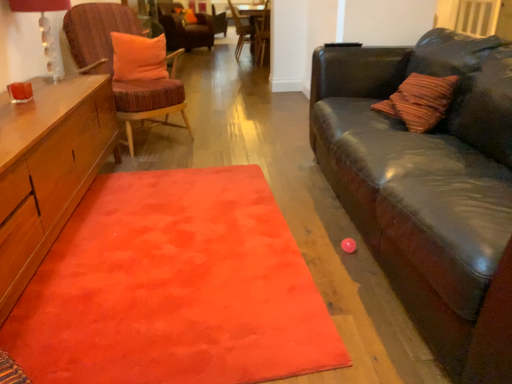
Question: Considering the positions of velvet orange cushion at upper center, the 1th chair when ordered from back to front, and wooden side table at center in the image, is velvet orange cushion at upper center, the 1th chair when ordered from back to front, taller or shorter than wooden side table at center?

Choices:
 (A) tall
 (B) short

Answer: (A)

Question: From the image's perspective, is velvet orange cushion at upper center, the 1th chair when ordered from back to front, above or below wooden side table at center?

Choices:
 (A) above
 (B) below

Answer: (A)

Question: Which of these objects is positioned farthest from the velvet orange cushion at upper center, which is the 4th chair in front-to-back order?

Choices:
 (A) wooden side table at center
 (B) wooden textured chair at upper center, positioned as the third chair in front-to-back order
 (C) orange fabric pillow at upper center, placed as the first pillow when sorted from left to right
 (D) orange plush pillow at upper left, which is counted as the first pillow, starting from the bottom
 (E) matte glass lampshade at upper left

Answer: (E)

Question: Based on their relative distances, which object is farther from the wooden chair at center, the 3th chair in the back-to-front sequence?

Choices:
 (A) velvet orange cushion at upper center, the 1th chair when ordered from back to front
 (B) wooden side table at center
 (C) orange fabric pillow at upper center, which is counted as the 1th pillow, starting from the back
 (D) orange soft rug at center
 (E) matte glass lampshade at upper left

Answer: (D)